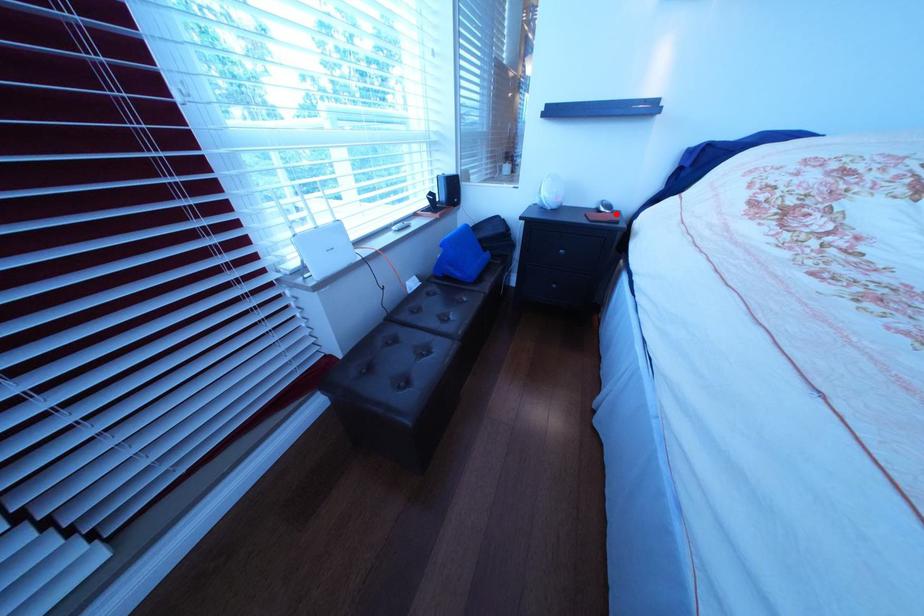
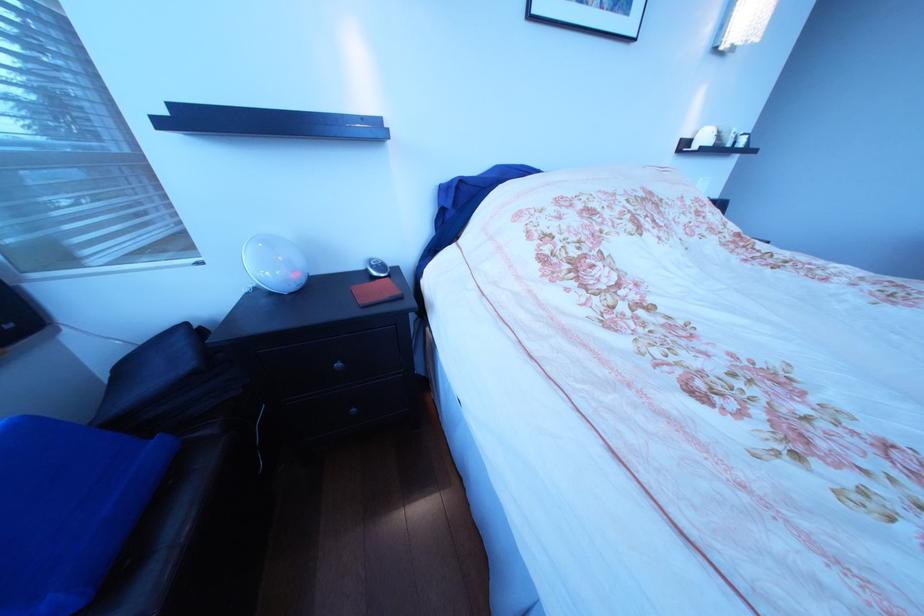
Locate, in the second image, the point that corresponds to the highlighted location in the first image.

(388, 281)